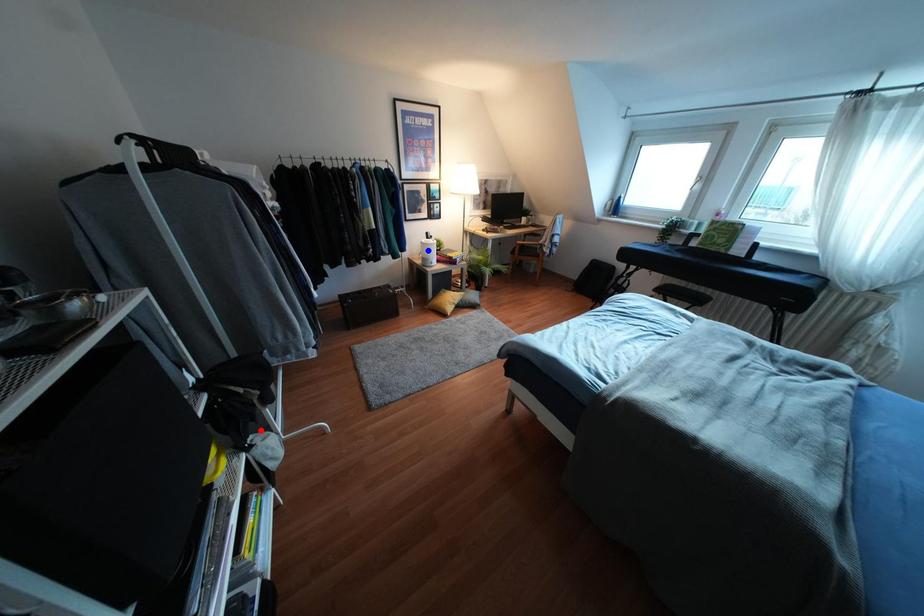
Question: Two points are marked on the image. Which point is closer to the camera?

Choices:
 (A) Blue point is closer.
 (B) Red point is closer.

Answer: (B)